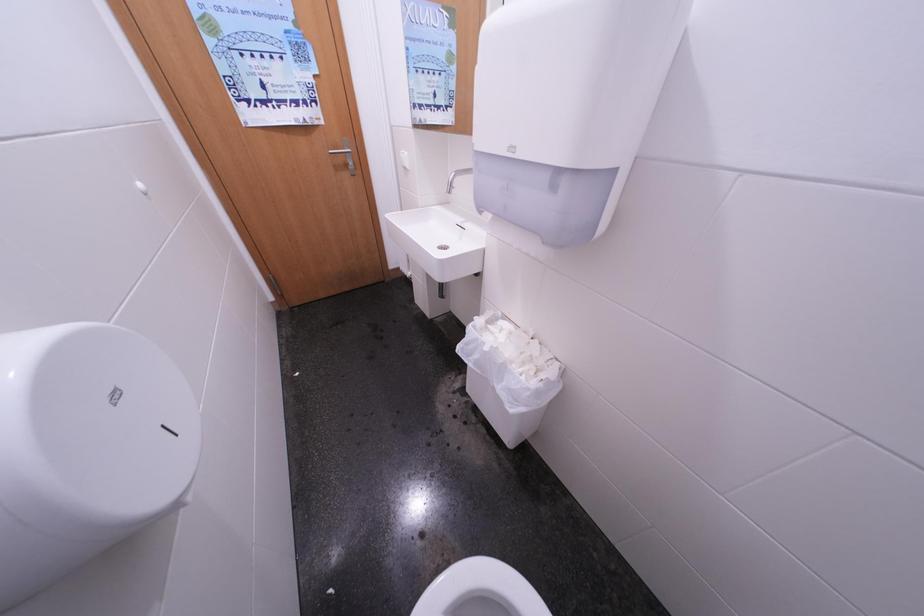
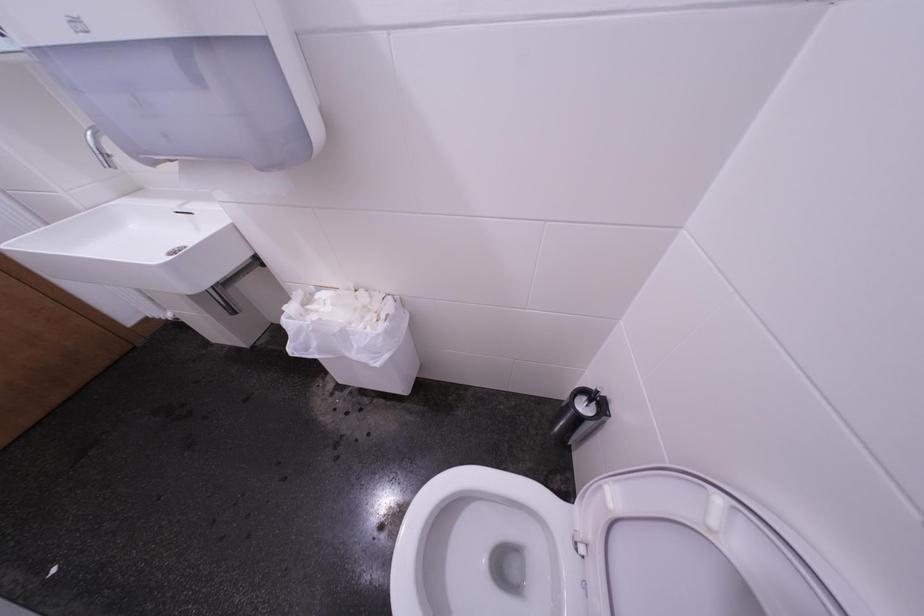
Based on the continuous images, in which direction is the camera rotating?

The camera rotated toward right-down.